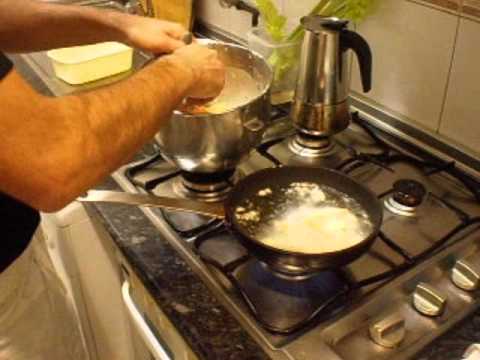
In order to click on gascooker in this screenshot , I will do `click(393, 240)`.